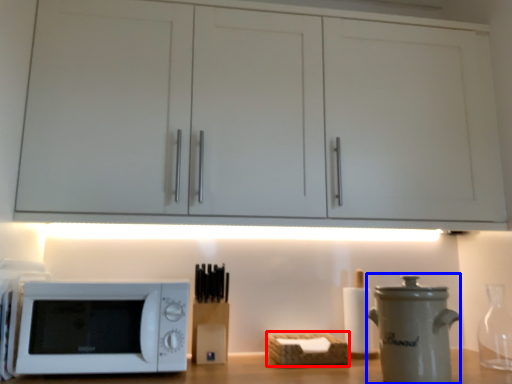
Question: Among these objects, which one is nearest to the camera, basket (highlighted by a red box) or appliance (highlighted by a blue box)?

Choices:
 (A) basket
 (B) appliance

Answer: (B)